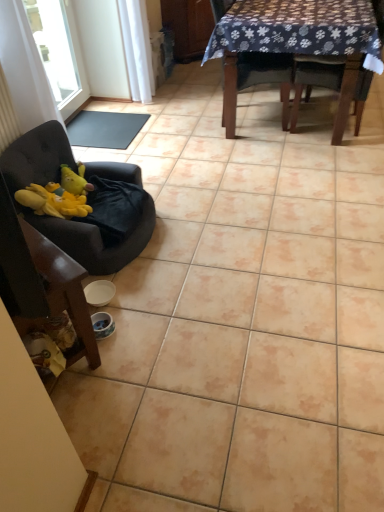
Find the location of a particular element. The image size is (384, 512). empty space that is ontop of black rubber mat at center (from a real-world perspective) is located at coordinates (95, 125).